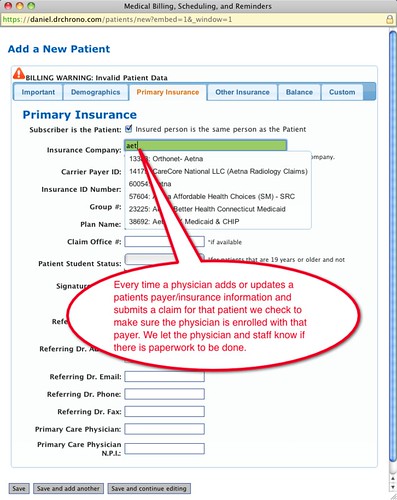
You are a GUI agent. You are given a task and a screenshot of the screen. Output one action in this format:
    pyautogui.click(x=<x>, y=<y>)
    Task: Click on the macos window controls
    
    Given the screenshot: What is the action you would take?
    pyautogui.click(x=10, y=7), pyautogui.click(x=21, y=6), pyautogui.click(x=30, y=5)